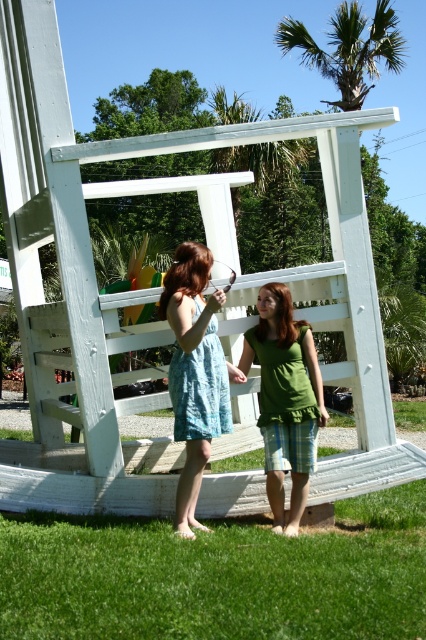
Does light blue cotton dress at center have a lesser height compared to green leafy palm tree at upper center?

Indeed, light blue cotton dress at center has a lesser height compared to green leafy palm tree at upper center.

Does light blue cotton dress at center come in front of green leafy palm tree at upper center?

Yes.

Locate an element on the screen. light blue cotton dress at center is located at coordinates (195, 372).

Is point (176, 532) in front of point (261, 336)?

Yes, point (176, 532) is in front of point (261, 336).

The height and width of the screenshot is (640, 426). What do you see at coordinates (195, 372) in the screenshot?
I see `light blue cotton dress at center` at bounding box center [195, 372].

Is point (192, 371) more distant than point (281, 310)?

No, (192, 371) is in front of (281, 310).

The width and height of the screenshot is (426, 640). I want to click on light blue cotton dress at center, so click(195, 372).

Is green fabric shirt at center positioned at the back of green leafy palm tree at upper center?

No, green fabric shirt at center is in front of green leafy palm tree at upper center.

What do you see at coordinates (284, 400) in the screenshot? I see `green fabric shirt at center` at bounding box center [284, 400].

Image resolution: width=426 pixels, height=640 pixels. I want to click on green fabric shirt at center, so click(x=284, y=400).